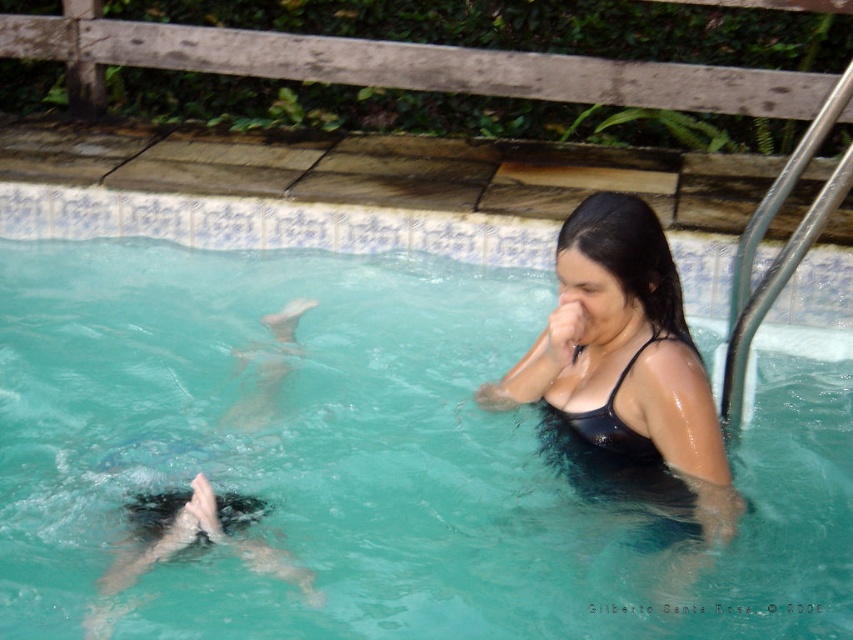
You are designing a swimsuit rack at a store and need to arrange the black matte swimsuit at upper right and the black matte bikini top at upper right side by side. Given their widths, which swimsuit should be placed on the left to ensure they fit within a 1.2 meter wide rack?

The black matte swimsuit at upper right is wider than the black matte bikini top at upper right. To fit them side by side on a 1.2 meter rack, place the wider swimsuit first on the left, followed by the bikini top on the right.

You are a photographer at the poolside and want to take a clear photo of the black matte bikini top at upper right. However, the clear plastic water at center is blocking your view. Can you adjust your position to capture the bikini top without the water obstructing it?

The black matte bikini top at upper right is behind the clear plastic water at center, so moving your position slightly to the side or angle your camera might allow you to capture the bikini top without the water obstructing it.

You are standing at the edge of the pool and want to reach a point marked as point (822, 518) in the water. If your maximum reach distance is 3 meters, can you comfortably touch that point without entering the water?

The point (822, 518) is 3.37 meters away from the viewer. Since your maximum reach is only 3 meters, you cannot comfortably touch that point without entering the water.